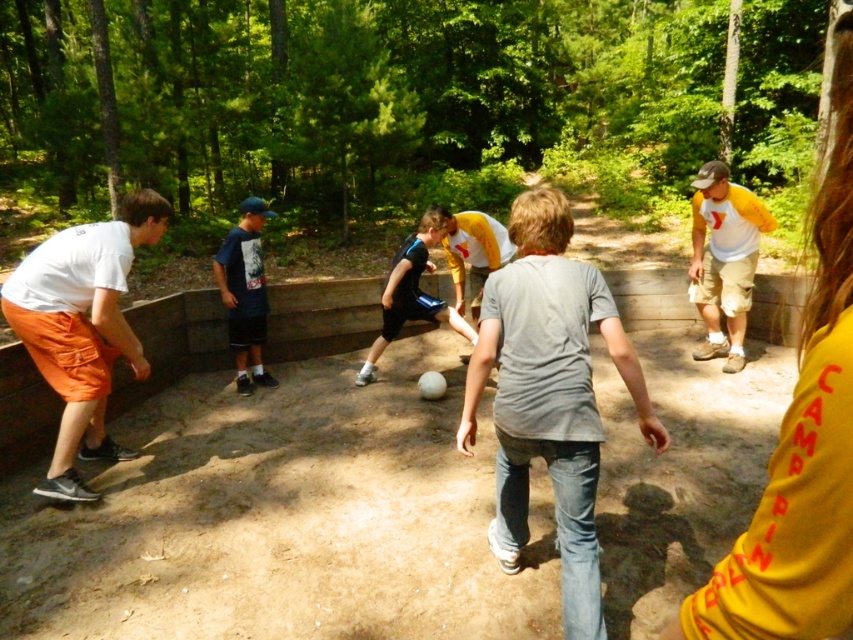
Question: Is gray cotton shirt at center to the right of dark blue t-shirt at center from the viewer's perspective?

Choices:
 (A) no
 (B) yes

Answer: (B)

Question: Among these objects, which one is farthest from the camera?

Choices:
 (A) white cotton shirt at left
 (B) yellow/white t-shirt at right
 (C) black matte shorts at center

Answer: (C)

Question: Which of the following is the closest to the observer?

Choices:
 (A) dark blue t-shirt at center
 (B) white cotton shirt at left
 (C) black matte shorts at center
 (D) yellow/white t-shirt at right

Answer: (B)

Question: Which object is closer to the camera taking this photo?

Choices:
 (A) black matte shorts at center
 (B) yellow/white t-shirt at right

Answer: (B)

Question: Is gray cotton shirt at center bigger than white cotton shirt at left?

Choices:
 (A) yes
 (B) no

Answer: (A)

Question: Is white cotton shirt at left thinner than black matte shorts at center?

Choices:
 (A) yes
 (B) no

Answer: (A)